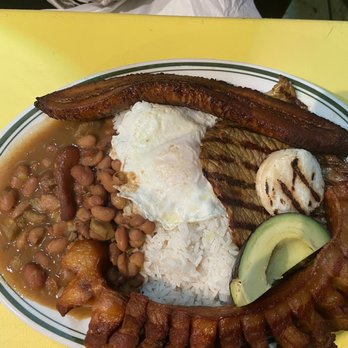
You are a GUI agent. You are given a task and a screenshot of the screen. Output one action in this format:
    pyautogui.click(x=<x>, y=<y>)
    Task: Click on the white plate
    The image size is (348, 348).
    Given the screenshot: What is the action you would take?
    pyautogui.click(x=78, y=325)